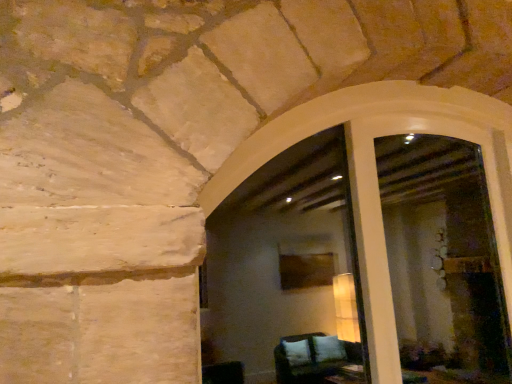
Question: From a real-world perspective, is white smooth window frame at center physically located above or below white glossy screen door at center?

Choices:
 (A) below
 (B) above

Answer: (A)

Question: Looking at their shapes, would you say white smooth window frame at center is wider or thinner than white glossy screen door at center?

Choices:
 (A) thin
 (B) wide

Answer: (B)

Question: Would you say white smooth window frame at center is inside or outside white glossy screen door at center?

Choices:
 (A) inside
 (B) outside

Answer: (A)

Question: From a real-world perspective, is white glossy screen door at center above or below white smooth window frame at center?

Choices:
 (A) below
 (B) above

Answer: (B)

Question: Considering the positions of point (506, 246) and point (378, 84), is point (506, 246) closer or farther from the camera than point (378, 84)?

Choices:
 (A) farther
 (B) closer

Answer: (A)

Question: Choose the correct answer: Is white glossy screen door at center inside white smooth window frame at center or outside it?

Choices:
 (A) inside
 (B) outside

Answer: (A)

Question: Considering the relative positions of white glossy screen door at center and white smooth window frame at center in the image provided, is white glossy screen door at center to the left or to the right of white smooth window frame at center?

Choices:
 (A) right
 (B) left

Answer: (A)